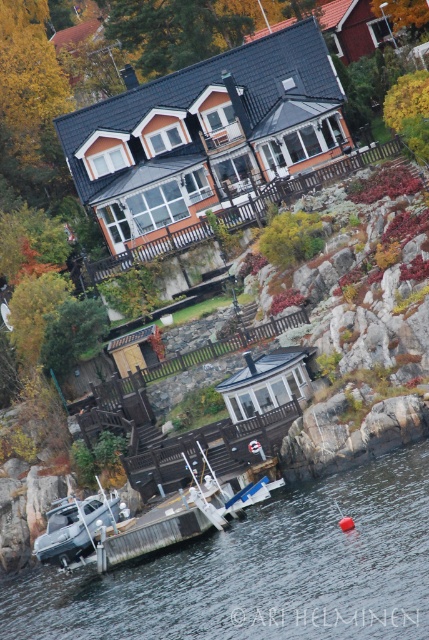
You are standing on the rocky cliff overlooking the clear water at lower center and the white plastic boat at lower center. Which object is positioned to the right side of the other?

The clear water at lower center is to the right of the white plastic boat at lower center.

You are standing at the viewpoint overlooking the coastal houses. You notice two points marked in the scene. Which point, point (x=317, y=579) or point (x=63, y=541), is closer to you?

Point (x=317, y=579) is closer to the viewer than point (x=63, y=541).